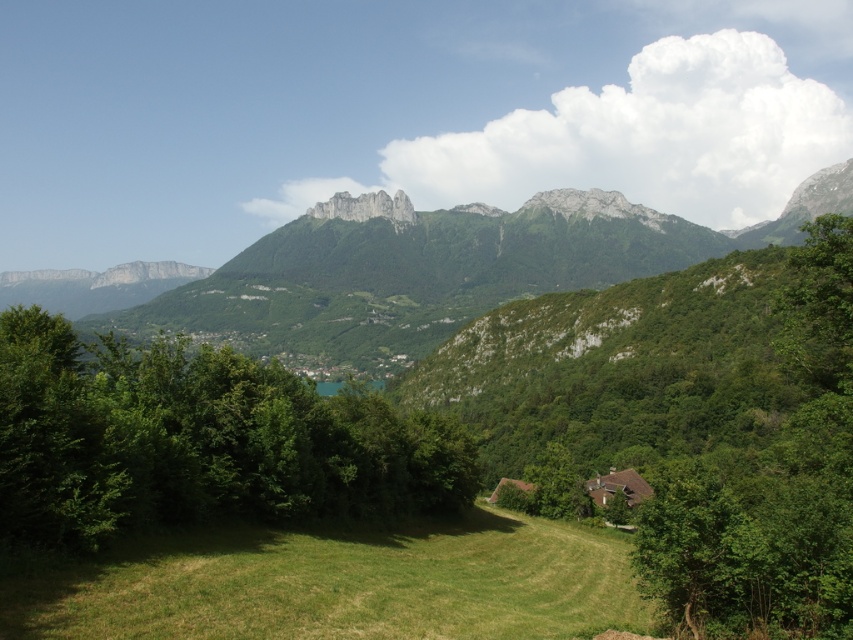
Question: Does green leafy tree at center have a lesser width compared to green grassy field at lower center?

Choices:
 (A) yes
 (B) no

Answer: (A)

Question: Is green leafy tree at center below green grassy field at lower center?

Choices:
 (A) no
 (B) yes

Answer: (A)

Question: Which point appears farthest from the camera in this image?

Choices:
 (A) (439, 589)
 (B) (239, 480)

Answer: (B)

Question: Is green leafy tree at center to the left of green grassy field at lower center from the viewer's perspective?

Choices:
 (A) no
 (B) yes

Answer: (B)